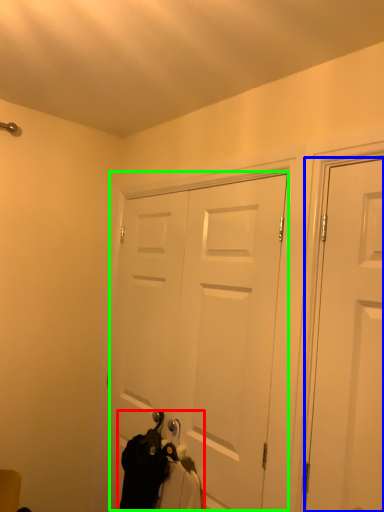
Question: Considering the real-world distances, which object is closest to laundry (highlighted by a red box)? door (highlighted by a blue box) or door (highlighted by a green box).

Choices:
 (A) door
 (B) door

Answer: (B)